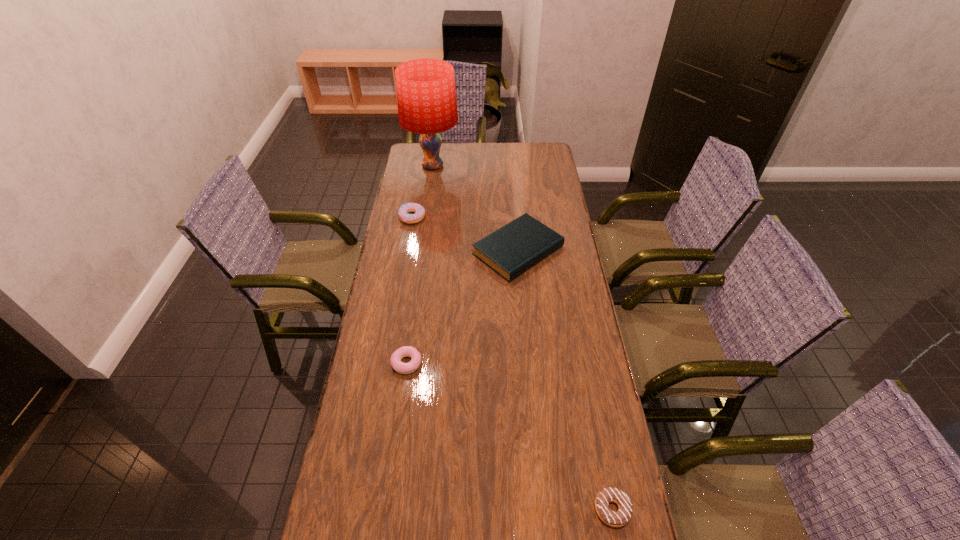
This screenshot has height=540, width=960. In order to click on the tallest object in this screenshot , I will do `click(426, 96)`.

Locate an element on the screen. lampshade is located at coordinates (426, 96).

Find the location of a particular element. This screenshot has width=960, height=540. book is located at coordinates (511, 250).

Locate an element on the screen. Image resolution: width=960 pixels, height=540 pixels. the farthest doughnut is located at coordinates click(403, 212).

Identify the location of the fourth farthest object. (406, 351).

The image size is (960, 540). Identify the location of the rightmost doughnut. (620, 518).

Find the location of a particular element. The height and width of the screenshot is (540, 960). the nearest doughnut is located at coordinates [x=620, y=518].

At what (x,y) coordinates should I click in order to perform the action: click on vacant space situated on the front-facing side of the farthest object. Please return your answer as a coordinate pair (x, y). This screenshot has height=540, width=960. Looking at the image, I should click on (525, 166).

Find the location of a particular element. The width and height of the screenshot is (960, 540). free space located 0.190m on the back of the book is located at coordinates (514, 195).

You are a GUI agent. You are given a task and a screenshot of the screen. Output one action in this format:
    pyautogui.click(x=<x>, y=<y>)
    Task: Click on the vacant space located 0.360m on the back of the tallest doughnut
    
    Given the screenshot: What is the action you would take?
    pyautogui.click(x=421, y=164)